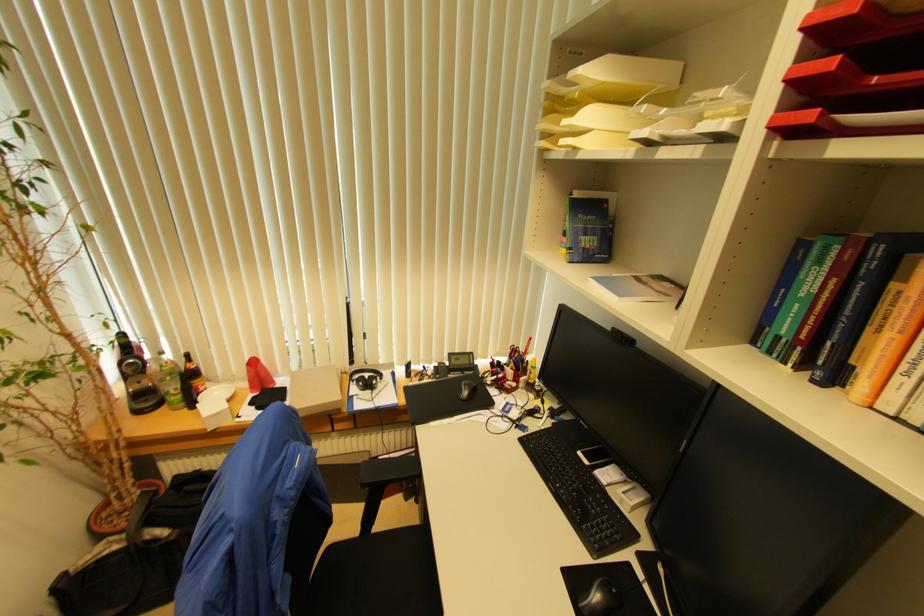
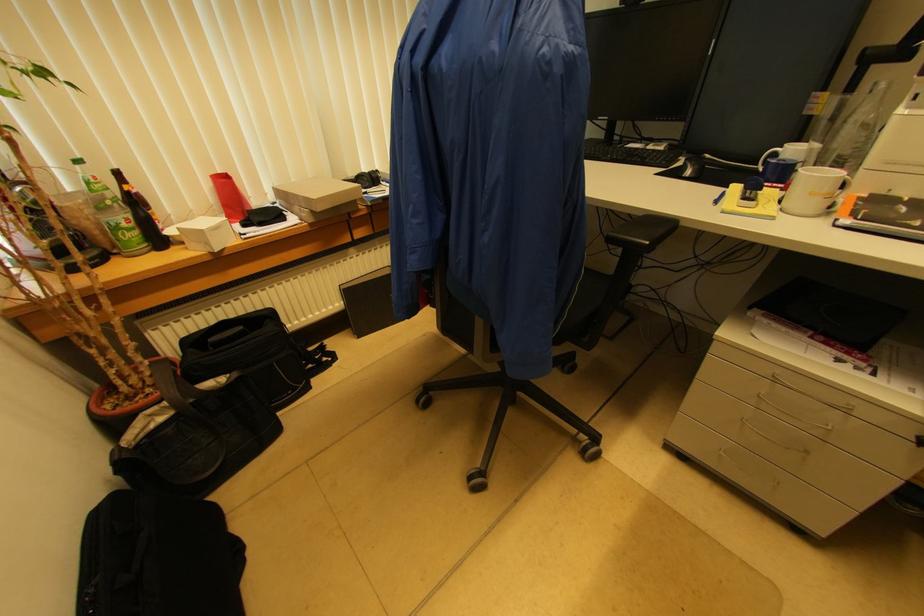
Locate, in the second image, the point that corresponds to pixel 188 358 in the first image.

(118, 176)